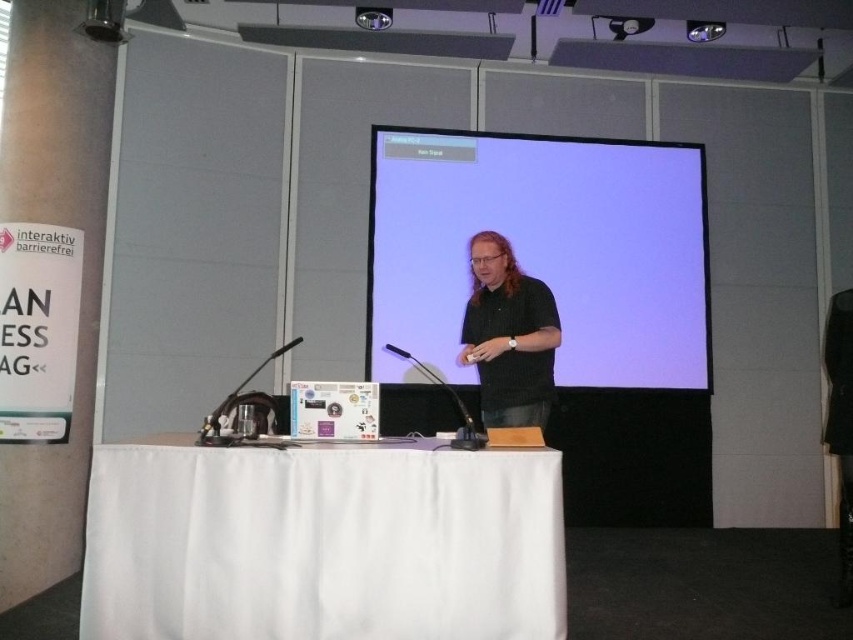
Does white fabric table at center have a larger size compared to black matte shirt at center?

Indeed, white fabric table at center has a larger size compared to black matte shirt at center.

Does white fabric table at center lie in front of black matte shirt at center?

Yes, white fabric table at center is closer to the viewer.

Identify the location of white fabric table at center. Image resolution: width=853 pixels, height=640 pixels. (322, 544).

The image size is (853, 640). I want to click on white fabric table at center, so click(322, 544).

Who is higher up, matte black screen at center or black matte shirt at center?

matte black screen at center is above.

In the scene shown: Is matte black screen at center positioned in front of black matte shirt at center?

No.

What do you see at coordinates (543, 250) in the screenshot? The image size is (853, 640). I see `matte black screen at center` at bounding box center [543, 250].

You are a GUI agent. You are given a task and a screenshot of the screen. Output one action in this format:
    pyautogui.click(x=<x>, y=<y>)
    Task: Click on the matte black screen at center
    This screenshot has height=640, width=853.
    Given the screenshot: What is the action you would take?
    pyautogui.click(x=543, y=250)

Can you confirm if white fabric table at center is taller than matte black screen at center?

No.

Can you confirm if white fabric table at center is smaller than matte black screen at center?

Correct, white fabric table at center occupies less space than matte black screen at center.

At what (x,y) coordinates should I click in order to perform the action: click on white fabric table at center. Please return your answer as a coordinate pair (x, y). The height and width of the screenshot is (640, 853). Looking at the image, I should click on (322, 544).